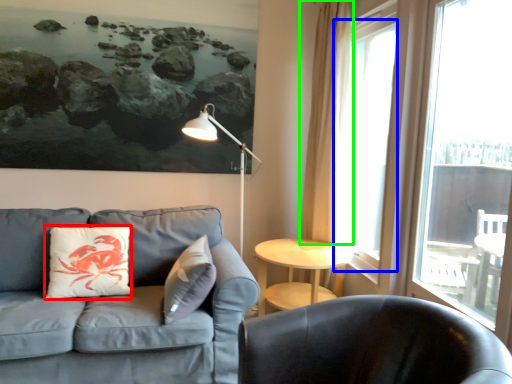
Question: Considering the real-world distances, which object is farthest from pillow (highlighted by a red box)? window (highlighted by a blue box) or curtain (highlighted by a green box)?

Choices:
 (A) window
 (B) curtain

Answer: (A)